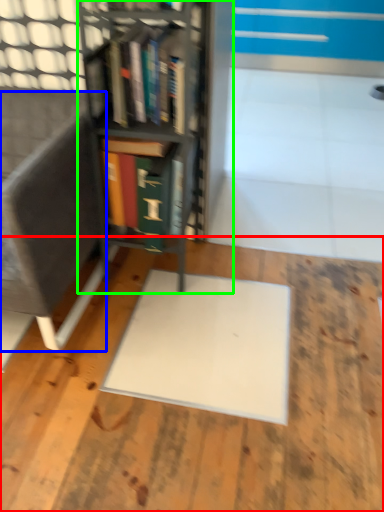
Question: Which object is the closest to the wood (highlighted by a red box)? Choose among these: armchair (highlighted by a blue box) or bookcase (highlighted by a green box).

Choices:
 (A) armchair
 (B) bookcase

Answer: (A)